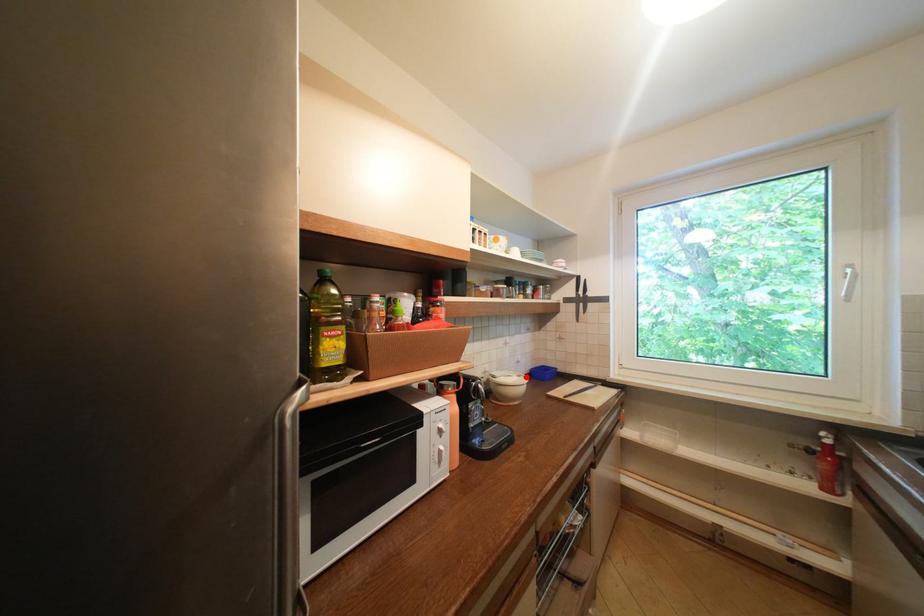
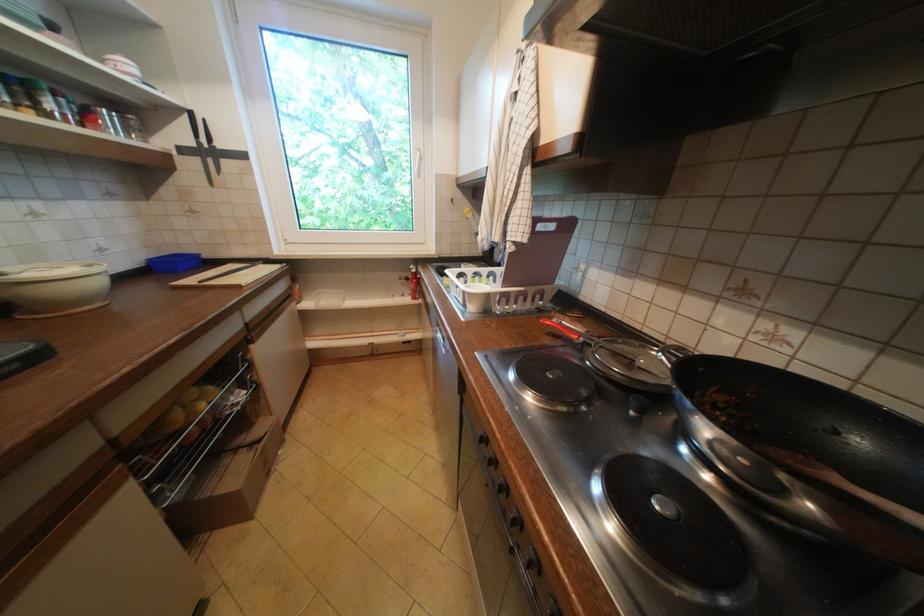
Question: I am providing you with two images of the same scene from different viewpoints. A red point is marked on the first image. At the location where the point appears in image 1, is it still visible in image 2?

Choices:
 (A) Yes
 (B) No

Answer: (A)